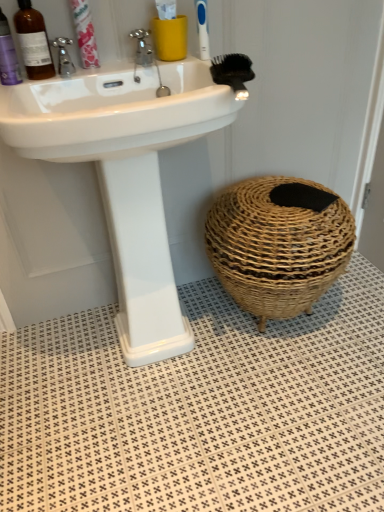
At what (x,y) coordinates should I click in order to perform the action: click on vacant area that is in front of white glossy sink at upper center. Please return your answer as a coordinate pair (x, y). Looking at the image, I should click on (160, 443).